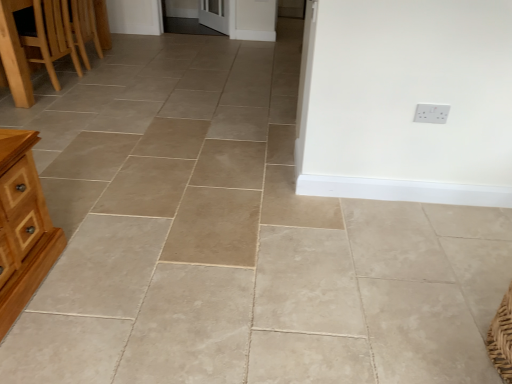
Find the location of a particular element. This screenshot has height=384, width=512. light brown wooden table at left is located at coordinates (14, 55).

I want to click on wooden chair at left, so pyautogui.click(x=14, y=54).

This screenshot has width=512, height=384. Find the location of `light brown wooden table at left`. light brown wooden table at left is located at coordinates (14, 55).

Is wooden chair at left taller or shorter than light brown wooden table at left?

Clearly, wooden chair at left is taller compared to light brown wooden table at left.

Is point (25, 94) farther from camera compared to point (2, 83)?

No.

From the image's perspective, which object appears higher, wooden chair at left or light brown wooden table at left?

wooden chair at left.

Who is more distant, wooden chair at left or light brown wooden table at left?

light brown wooden table at left is further away from the camera.

Find the location of a particular element. furniture in front of the light brown wooden table at left is located at coordinates point(14,54).

Considering the relative sizes of light brown wooden table at left and wooden chair at left in the image provided, is light brown wooden table at left shorter than wooden chair at left?

Correct, light brown wooden table at left is not as tall as wooden chair at left.

Is wooden chair at left surrounded by light brown wooden table at left?

Actually, wooden chair at left is outside light brown wooden table at left.

From a real-world perspective, does light brown wooden table at left stand above wooden chair at left?

Actually, light brown wooden table at left is physically below wooden chair at left in the real world.

Is white plastic electric outlet at upper right bigger than light brown wooden table at left?

No.

From a real-world perspective, is white plastic electric outlet at upper right under light brown wooden table at left?

No.

How distant is white plastic electric outlet at upper right from light brown wooden table at left?

2.68 meters.

Is white plastic electric outlet at upper right facing away from light brown wooden table at left?

No, light brown wooden table at left is not at the back of white plastic electric outlet at upper right.

Which is farther from the camera, (x=18, y=48) or (x=437, y=112)?

The point (x=18, y=48) is behind.

Would you say wooden chair at left is a long distance from white plastic electric outlet at upper right?

Yes.

Between wooden chair at left and white plastic electric outlet at upper right, which one has less height?

With less height is white plastic electric outlet at upper right.

Is wooden chair at left inside white plastic electric outlet at upper right?

No, white plastic electric outlet at upper right does not contain wooden chair at left.

From a real-world perspective, between white plastic electric outlet at upper right and wooden chair at left, who is vertically higher?

white plastic electric outlet at upper right, from a real-world perspective.

Which object is further away from the camera taking this photo, white plastic electric outlet at upper right or wooden chair at left?

Positioned behind is wooden chair at left.

What's the angular difference between white plastic electric outlet at upper right and wooden chair at left's facing directions?

There is a 90.1-degree angle between the facing directions of white plastic electric outlet at upper right and wooden chair at left.

Who is taller, light brown wooden table at left or white plastic electric outlet at upper right?

Standing taller between the two is light brown wooden table at left.

From a real-world perspective, which object rests below the other?

light brown wooden table at left is physically lower.

Where is `table on the left of the white plastic electric outlet at upper right`? This screenshot has width=512, height=384. table on the left of the white plastic electric outlet at upper right is located at coordinates (14, 55).

Considering the sizes of objects light brown wooden table at left and white plastic electric outlet at upper right in the image provided, who is wider, light brown wooden table at left or white plastic electric outlet at upper right?

With larger width is light brown wooden table at left.

At what (x,y) coordinates should I click in order to perform the action: click on furniture above the light brown wooden table at left (from a real-world perspective). Please return your answer as a coordinate pair (x, y). Looking at the image, I should click on (14, 54).

Identify the location of table behind the wooden chair at left. (14, 55).

Estimate the real-world distances between objects in this image. Which object is further from wooden chair at left, light brown wooden table at left or white plastic electric outlet at upper right?

white plastic electric outlet at upper right.

Considering their positions, is wooden chair at left positioned further to white plastic electric outlet at upper right than light brown wooden table at left?

wooden chair at left is further to white plastic electric outlet at upper right.

Looking at this image, considering their positions, is light brown wooden table at left positioned further to white plastic electric outlet at upper right than wooden chair at left?

Among the two, wooden chair at left is located further to white plastic electric outlet at upper right.

Which object lies nearer to the anchor point light brown wooden table at left, white plastic electric outlet at upper right or wooden chair at left?

wooden chair at left lies closer to light brown wooden table at left than the other object.

Based on their spatial positions, is wooden chair at left or white plastic electric outlet at upper right further from light brown wooden table at left?

white plastic electric outlet at upper right lies further to light brown wooden table at left than the other object.

From the image, which object appears to be farther from wooden chair at left, white plastic electric outlet at upper right or light brown wooden table at left?

The object further to wooden chair at left is white plastic electric outlet at upper right.

This screenshot has width=512, height=384. I want to click on table between wooden chair at left and white plastic electric outlet at upper right, so 14,55.